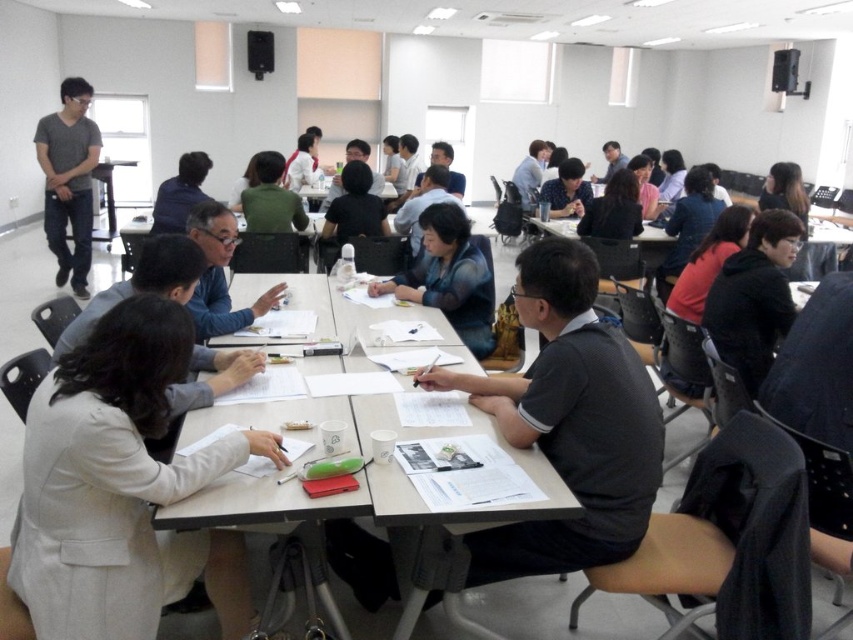
Question: Which object is the closest to the white fabric jacket at lower left?

Choices:
 (A) black matte jacket at right
 (B) green matte shirt at center
 (C) matte black shirt at center
 (D) matte blue shirt at center

Answer: (A)

Question: Considering the real-world distances, which object is closest to the gray cotton shirt at left?

Choices:
 (A) black matte jacket at right
 (B) dark gray shirt at center
 (C) green matte shirt at center

Answer: (C)

Question: Which point is farther to the camera?

Choices:
 (A) (67, 152)
 (B) (463, 218)

Answer: (A)

Question: Can you confirm if black matte jacket at right is bigger than matte plastic table at center?

Choices:
 (A) yes
 (B) no

Answer: (B)

Question: Can you confirm if dark gray shirt at center is positioned to the right of blue denim jacket at center?

Choices:
 (A) yes
 (B) no

Answer: (A)

Question: Observing the image, what is the correct spatial positioning of dark gray shirt at center in reference to blue denim jacket at center?

Choices:
 (A) below
 (B) above

Answer: (A)